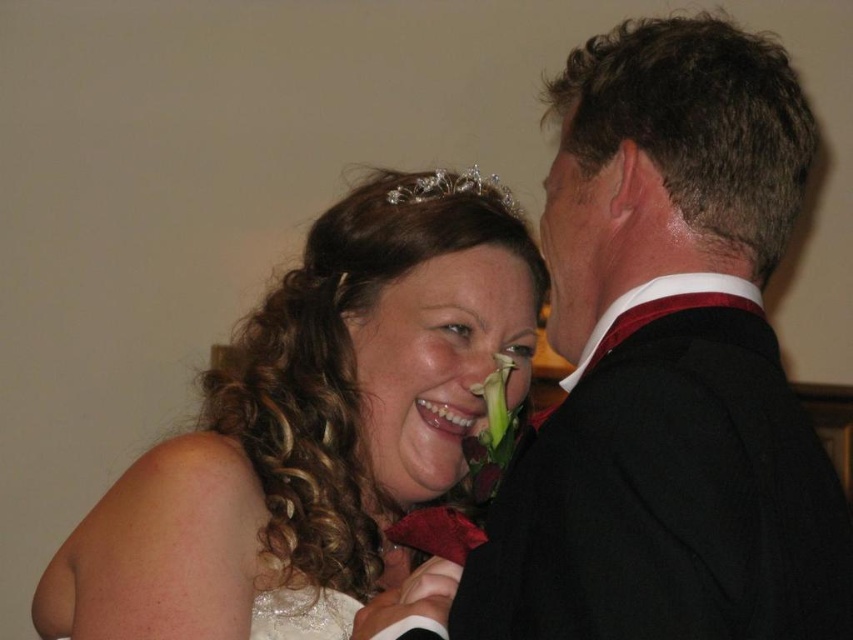
You are a photographer at a wedding event. You need to position the black satin suit at upper right and the white lace dress at lower left in a group photo. Considering their sizes, which one should you place closer to the camera to make them appear balanced in the photo?

The black satin suit at upper right is larger in size compared to the white lace dress at lower left. To balance their appearance in the photo, you should position the white lace dress at lower left closer to the camera since it is smaller, making it appear larger, while the larger black satin suit at upper right can be placed slightly farther back to balance their sizes.

You are a photographer at a wedding and need to adjust the lighting to ensure both the white lace dress at lower left and the clear crystal tiara at upper center are well lit. Based on their positions, which object should you focus the light on first to ensure it is properly illuminated?

The white lace dress at lower left is in front of the clear crystal tiara at upper center, so you should focus the light on the white lace dress at lower left first to ensure it doesn

You are a photographer trying to capture a closeup of the groom in the image. You notice two points marked in the image at coordinates point (595, 344) and point (450, 177). Which point should you focus on to ensure the groom is in the foreground?

Point (595, 344) is in front of point (450, 177), so focusing on point (595, 344) will ensure the groom is in the foreground.